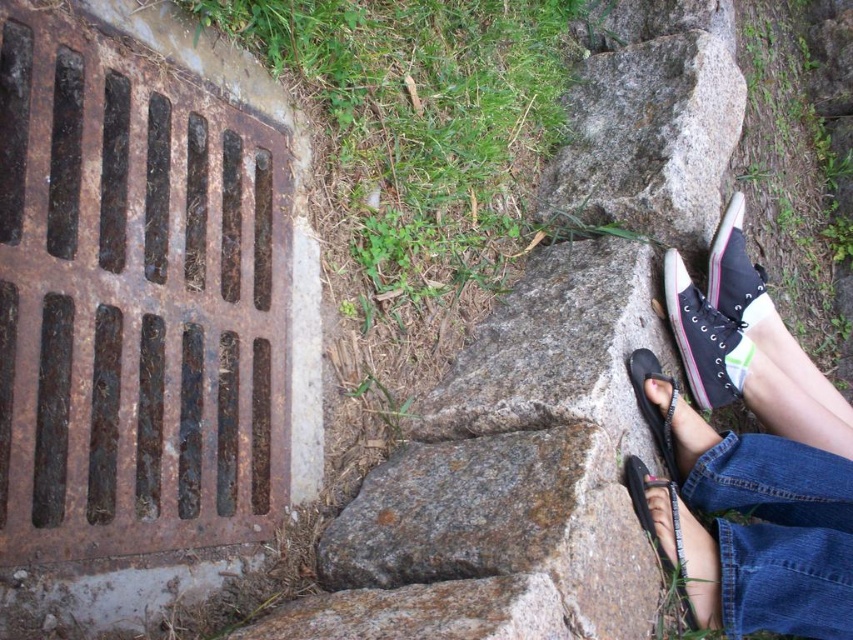
Question: Is black canvas sneakers at lower right to the right of black rubber sandal at lower right from the viewer's perspective?

Choices:
 (A) yes
 (B) no

Answer: (A)

Question: Is black canvas sneakers at lower right to the right of pink canvas shoe at upper right from the viewer's perspective?

Choices:
 (A) no
 (B) yes

Answer: (A)

Question: Which of the following is the closest to the observer?

Choices:
 (A) (398, 220)
 (B) (683, 477)
 (C) (668, 509)

Answer: (C)

Question: Which point is closer to the camera?

Choices:
 (A) black canvas shoe at right
 (B) black leather sandal at lower right
 (C) black rubber sandal at lower right

Answer: (B)

Question: Considering the relative positions of green grass at upper center and black canvas sneakers at lower right in the image provided, where is green grass at upper center located with respect to black canvas sneakers at lower right?

Choices:
 (A) right
 (B) left

Answer: (B)

Question: Which point is closer to the camera?

Choices:
 (A) black canvas sneakers at lower right
 (B) pink canvas shoe at upper right
 (C) black rubber sandal at lower right
 (D) black leather sandal at lower right

Answer: (D)